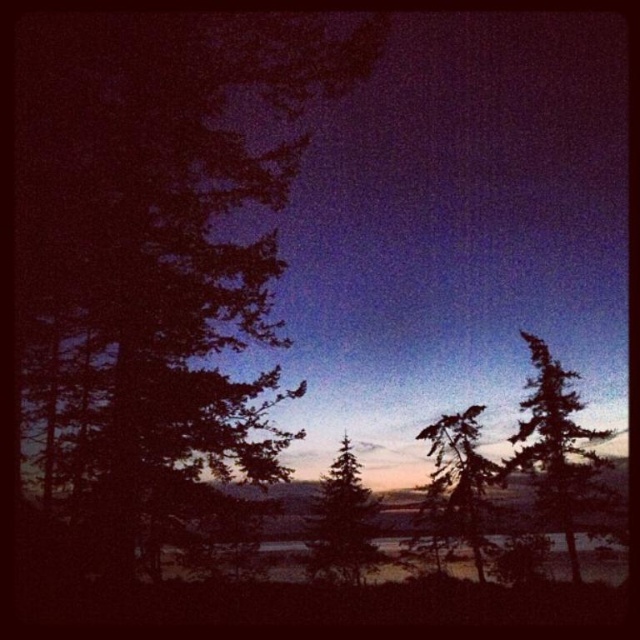
Can you confirm if green matte tree at right is wider than silhouetted evergreen tree at center?

Correct, the width of green matte tree at right exceeds that of silhouetted evergreen tree at center.

Can you confirm if green matte tree at right is taller than silhouetted evergreen tree at center?

Yes, green matte tree at right is taller than silhouetted evergreen tree at center.

Is point (552, 472) behind point (461, 516)?

No, (552, 472) is in front of (461, 516).

Locate an element on the screen. This screenshot has height=640, width=640. green matte tree at right is located at coordinates (557, 445).

Between silhouetted evergreen tree at center and transparent water at center, which one is positioned higher?

silhouetted evergreen tree at center is above.

Does silhouetted evergreen tree at center lie in front of transparent water at center?

No, it is not.

Is point (422, 506) closer to camera compared to point (269, 577)?

That is True.

Find the location of a particular element. This screenshot has width=640, height=640. silhouetted evergreen tree at center is located at coordinates (458, 481).

Does point (572, 547) come farther from viewer compared to point (356, 474)?

That is False.

Between point (506, 461) and point (344, 436), which one is positioned in front?

Point (506, 461) is in front.

Find the location of a particular element. The width and height of the screenshot is (640, 640). green matte tree at right is located at coordinates (557, 445).